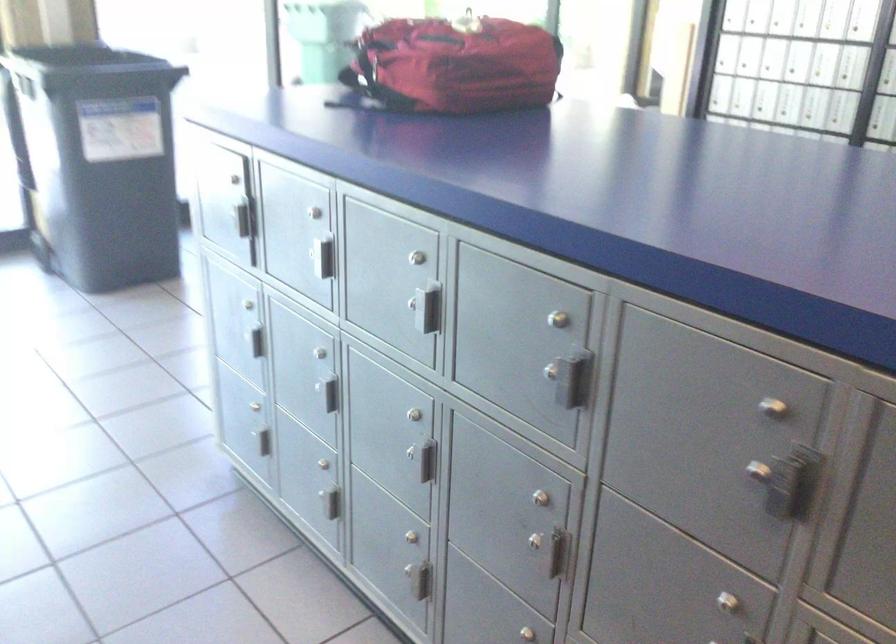
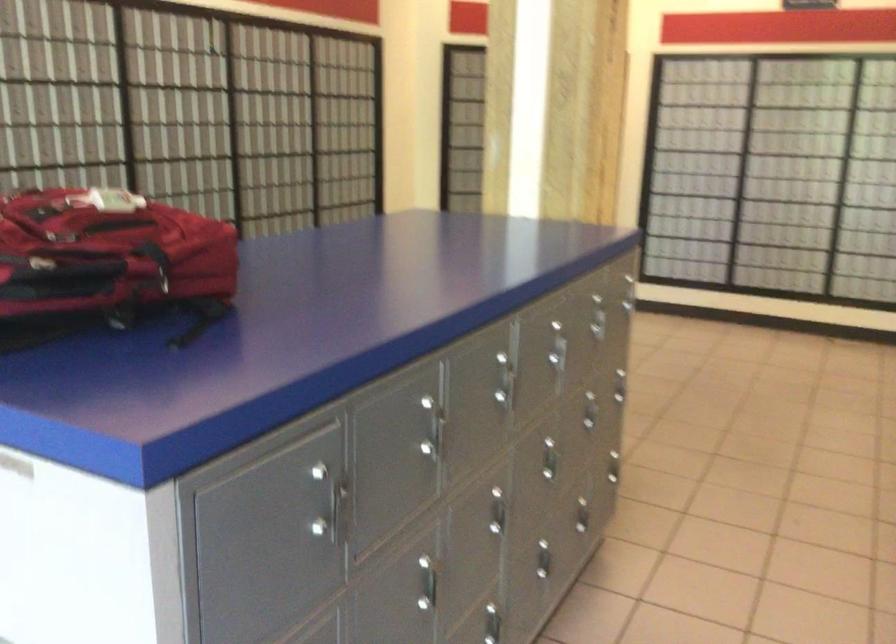
Locate, in the second image, the point that corresponds to pixel 745 449 in the first image.

(601, 317)